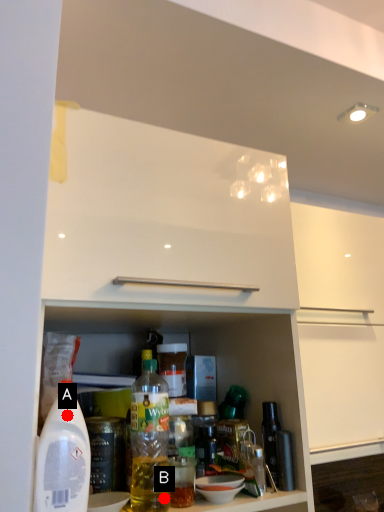
Question: Two points are circled on the image, labeled by A and B beside each circle. Which of the following is the closest to the observer?

Choices:
 (A) A is closer
 (B) B is closer

Answer: (A)